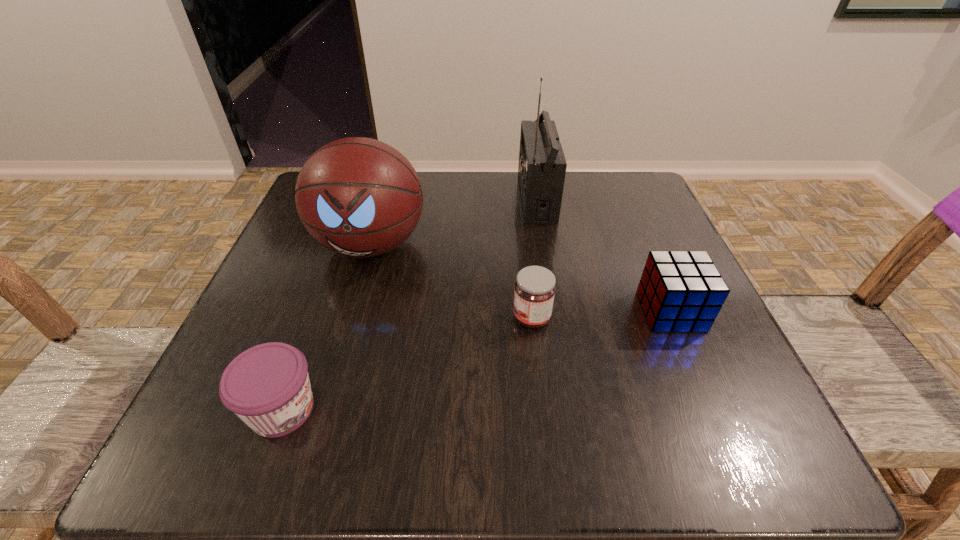
What are the coordinates of `free space located on the left of the cube` in the screenshot? It's located at (455, 311).

Find the location of `free space located on the back of the farther jam`. free space located on the back of the farther jam is located at coordinates (526, 273).

You are a GUI agent. You are given a task and a screenshot of the screen. Output one action in this format:
    pyautogui.click(x=<x>, y=<y>)
    Task: Click on the vacant space situated on the front label of the nearest object
    The image size is (960, 540).
    Given the screenshot: What is the action you would take?
    pyautogui.click(x=420, y=409)

Identify the location of radio receiver at the far edge. The height and width of the screenshot is (540, 960). (542, 166).

Locate an element on the screen. The width and height of the screenshot is (960, 540). basketball present at the far edge is located at coordinates (359, 197).

The image size is (960, 540). I want to click on object present at the near edge, so click(267, 386).

In order to click on basketball located in the left edge section of the desktop in this screenshot , I will do `click(359, 197)`.

Where is `jam that is at the left edge`? Image resolution: width=960 pixels, height=540 pixels. jam that is at the left edge is located at coordinates (267, 386).

The image size is (960, 540). I want to click on object located in the right edge section of the desktop, so click(680, 291).

The height and width of the screenshot is (540, 960). Identify the location of object at the far left corner. (359, 197).